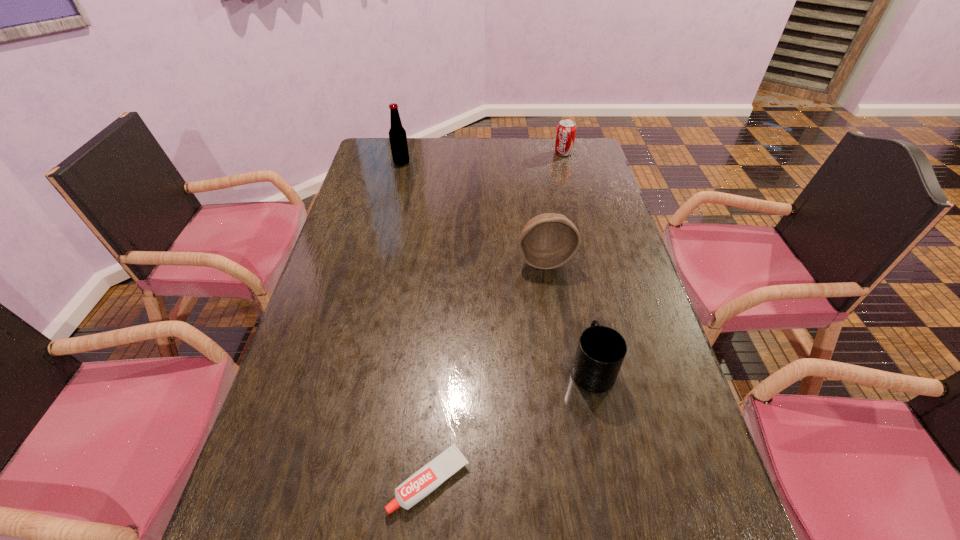
Find the location of a particular element. The width and height of the screenshot is (960, 540). the leftmost object is located at coordinates (397, 135).

Locate an element on the screen. This screenshot has height=540, width=960. the fourth nearest object is located at coordinates (397, 135).

What are the coordinates of `the third nearest object` in the screenshot? It's located at 547,241.

Locate an element on the screen. the second tallest object is located at coordinates (547, 241).

Find the location of `the farthest object`. the farthest object is located at coordinates (566, 130).

Identify the location of the fourth farthest object. The image size is (960, 540). (601, 350).

In order to click on toothpaste in this screenshot , I will do `click(429, 477)`.

I want to click on the fourth object from right to left, so click(x=429, y=477).

Where is `vacant space located 0.150m on the back of the leftmost object`? This screenshot has width=960, height=540. vacant space located 0.150m on the back of the leftmost object is located at coordinates (407, 140).

Locate an element on the screen. free space located on the front of the third nearest object is located at coordinates [x=557, y=337].